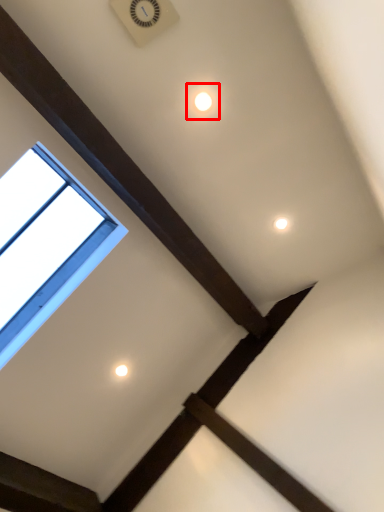
Question: Where is dot (annotated by the red box) located in relation to window in the image?

Choices:
 (A) right
 (B) left

Answer: (A)